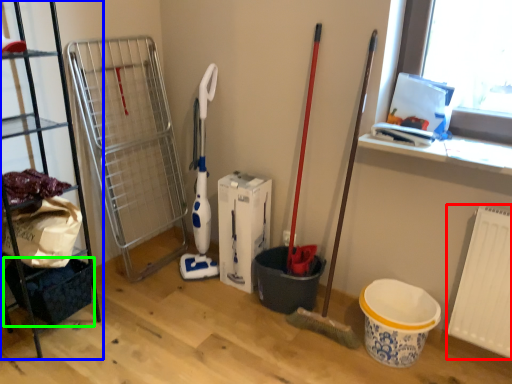
Question: Which is nearer to the radiator (highlighted by a red box)? shelf (highlighted by a blue box) or basket (highlighted by a green box).

Choices:
 (A) shelf
 (B) basket

Answer: (B)